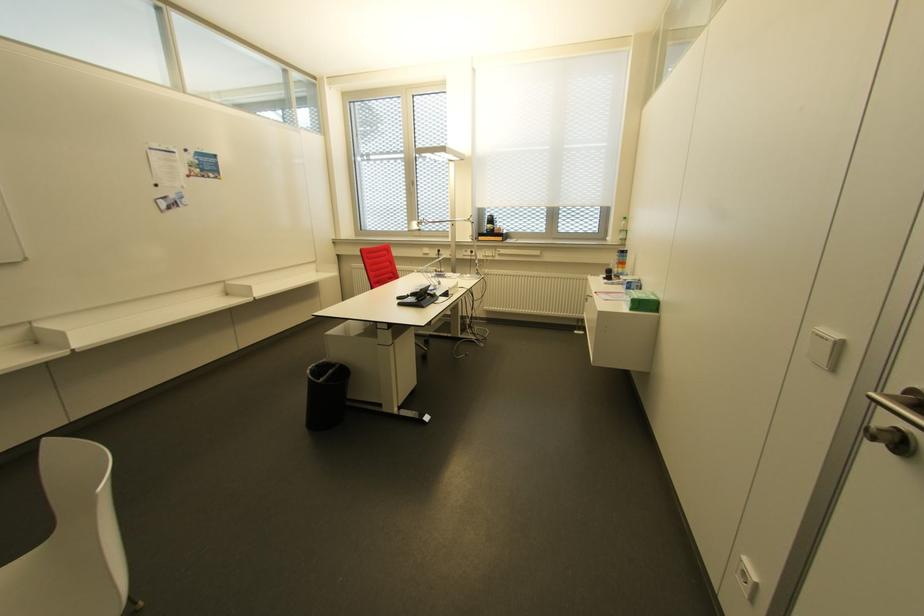
At what (x,y) coordinates should I click in order to perform the action: click on white light switch. Please return your answer as a coordinate pair (x, y). Looking at the image, I should click on (824, 349).